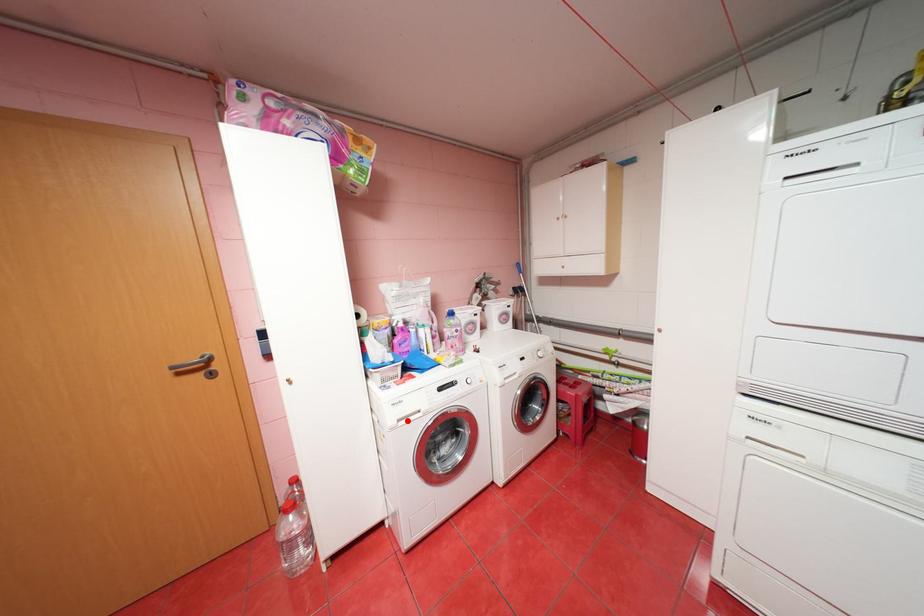
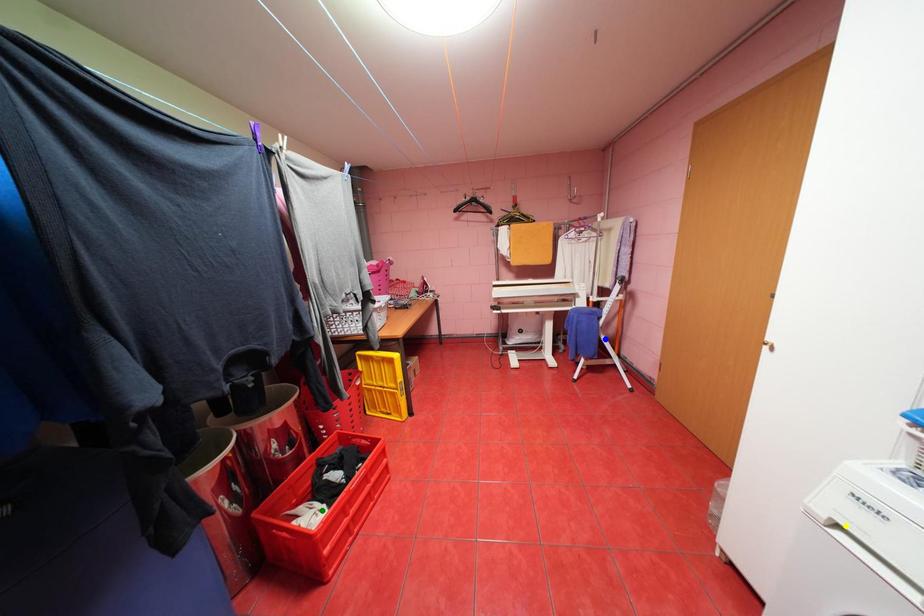
Question: I am providing you with two images of the same scene from different viewpoints. A red point is marked on the first image. You are given multiple points on the second image. Which spot in image 2 lines up with the point in image 1?

Choices:
 (A) yellow point
 (B) green point
 (C) blue point

Answer: (A)